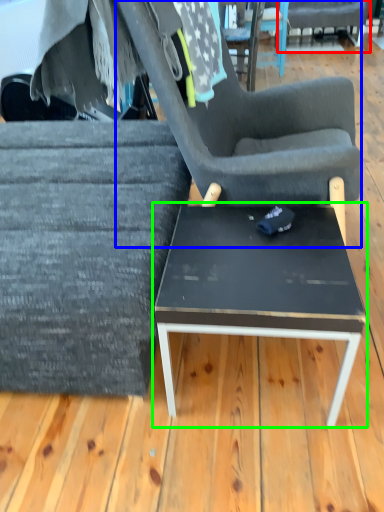
Question: Which object is the farthest from chair (highlighted by a red box)? Choose among these: chair (highlighted by a blue box) or coffee table (highlighted by a green box).

Choices:
 (A) chair
 (B) coffee table

Answer: (B)